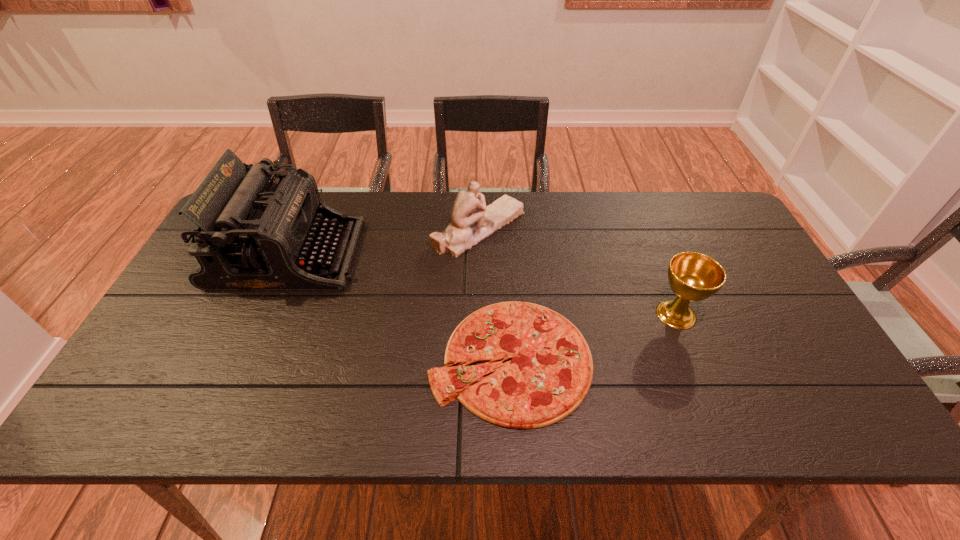
The image size is (960, 540). Identify the location of figurine that is at the far edge. pos(472,221).

Identify the location of object present at the near edge. (550, 371).

Locate an element on the screen. object that is at the left edge is located at coordinates pos(250,234).

Identify the location of object located in the far left corner section of the desktop. The image size is (960, 540). (250, 234).

What are the coordinates of `free spot at the far edge of the desktop` in the screenshot? It's located at (602, 194).

Identify the location of blank space at the near edge of the desktop. The height and width of the screenshot is (540, 960). (396, 394).

This screenshot has width=960, height=540. I want to click on vacant space at the left edge of the desktop, so click(150, 384).

The height and width of the screenshot is (540, 960). What are the coordinates of `vacant space at the near left corner of the desktop` in the screenshot? It's located at (148, 393).

What are the coordinates of `vacant space at the near right corner of the desktop` in the screenshot? It's located at (804, 424).

The width and height of the screenshot is (960, 540). Identify the location of free spot between the figurine and the shortest object. (494, 294).